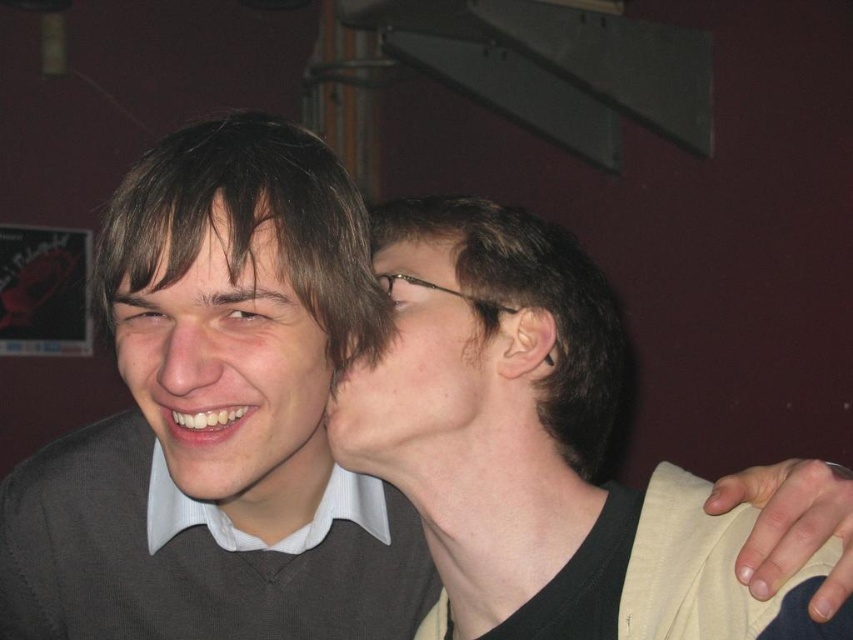
Question: Is matte black face at left to the right of matte skin at center from the viewer's perspective?

Choices:
 (A) yes
 (B) no

Answer: (B)

Question: Is matte black hair at center further to camera compared to matte skin at center?

Choices:
 (A) yes
 (B) no

Answer: (B)

Question: Which of the following is the farthest from the observer?

Choices:
 (A) (360, 412)
 (B) (369, 403)
 (C) (169, 468)

Answer: (C)

Question: Does matte black hair at center come behind matte black face at left?

Choices:
 (A) no
 (B) yes

Answer: (A)

Question: Which of the following is the closest to the observer?

Choices:
 (A) (344, 400)
 (B) (320, 420)

Answer: (A)

Question: Which point is farther from the camera taking this photo?

Choices:
 (A) (339, 394)
 (B) (532, 262)

Answer: (B)